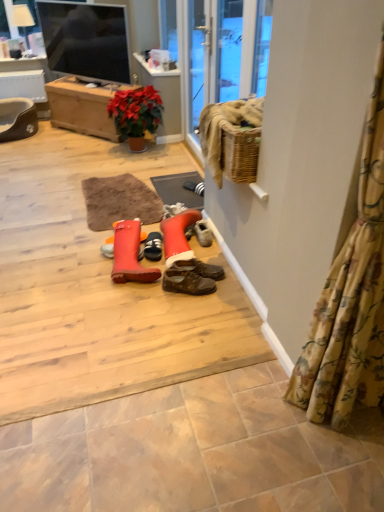
Question: Is matte beige tile at lower center shorter than brown leather shoes at center, the 1th footwear from the right?

Choices:
 (A) yes
 (B) no

Answer: (A)

Question: Considering the relative positions of matte beige tile at lower center and brown leather shoes at center, the 1th footwear from the right, in the image provided, is matte beige tile at lower center to the right of brown leather shoes at center, the 1th footwear from the right, from the viewer's perspective?

Choices:
 (A) no
 (B) yes

Answer: (B)

Question: From a real-world perspective, is matte beige tile at lower center over brown leather shoes at center, the third footwear from the left?

Choices:
 (A) yes
 (B) no

Answer: (B)

Question: From the image's perspective, is matte beige tile at lower center on top of brown leather shoes at center, the 1th footwear from the right?

Choices:
 (A) yes
 (B) no

Answer: (B)

Question: Is matte beige tile at lower center at the left side of brown leather shoes at center, the 1th footwear from the right?

Choices:
 (A) yes
 (B) no

Answer: (B)

Question: In the image, is brown leather shoes at center, the 1th footwear from the right, on the left side or the right side of floral fabric curtain at right?

Choices:
 (A) right
 (B) left

Answer: (B)

Question: Considering the positions of point pos(185,267) and point pos(370,373), is point pos(185,267) closer or farther from the camera than point pos(370,373)?

Choices:
 (A) farther
 (B) closer

Answer: (A)

Question: Relative to floral fabric curtain at right, is brown leather shoes at center, the 1th footwear from the right, in front or behind?

Choices:
 (A) front
 (B) behind

Answer: (B)

Question: Is brown leather shoes at center, the 1th footwear from the right, inside the boundaries of floral fabric curtain at right, or outside?

Choices:
 (A) inside
 (B) outside

Answer: (B)

Question: Considering their positions, is rubberized orange boot at center, which ranks as the third footwear in right-to-left order, located in front of or behind brown leather shoes at center, the third footwear from the left?

Choices:
 (A) behind
 (B) front

Answer: (B)

Question: From a real-world perspective, is rubberized orange boot at center, which ranks as the third footwear in right-to-left order, positioned above or below brown leather shoes at center, the 1th footwear from the right?

Choices:
 (A) above
 (B) below

Answer: (A)

Question: Is point (132, 228) closer or farther from the camera than point (192, 258)?

Choices:
 (A) farther
 (B) closer

Answer: (A)

Question: From the image's perspective, is rubberized orange boot at center, which ranks as the third footwear in right-to-left order, located above or below brown leather shoes at center, the third footwear from the left?

Choices:
 (A) below
 (B) above

Answer: (B)

Question: Is black rubber doormat at center taller or shorter than floral fabric curtain at right?

Choices:
 (A) short
 (B) tall

Answer: (A)

Question: Considering the relative positions of black rubber doormat at center and floral fabric curtain at right in the image provided, is black rubber doormat at center to the left or to the right of floral fabric curtain at right?

Choices:
 (A) right
 (B) left

Answer: (B)